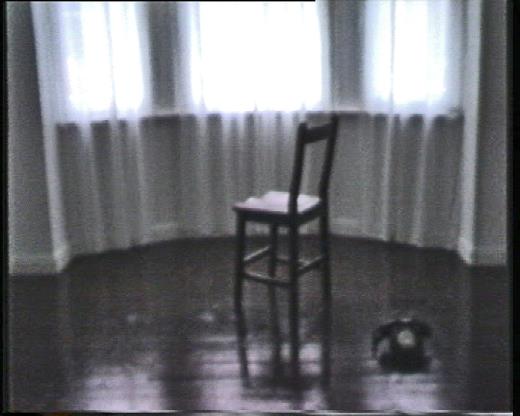
What are the coordinates of `floor` in the screenshot? It's located at (268, 350).